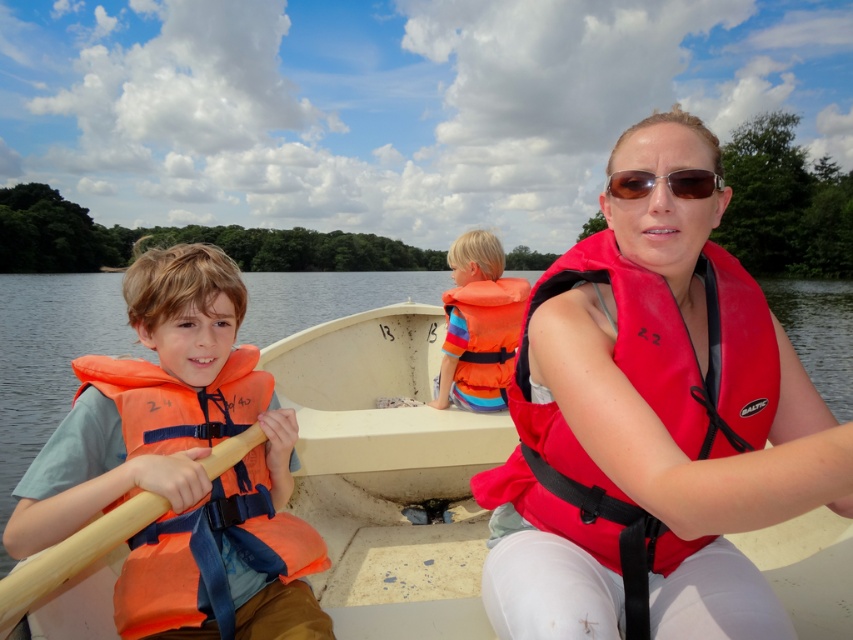
Question: Can you confirm if white plastic boat at center is positioned above orange life vest at left?

Choices:
 (A) no
 (B) yes

Answer: (B)

Question: Does orange life vest at left lie in front of matte brown sunglasses at center?

Choices:
 (A) no
 (B) yes

Answer: (B)

Question: Which object appears farthest from the camera in this image?

Choices:
 (A) orange fabric life jacket at center
 (B) matte brown sunglasses at center
 (C) wooden paddle at center

Answer: (A)

Question: Which object is the closest to the orange life vest at left?

Choices:
 (A) wooden paddle at center
 (B) matte red life vest at center
 (C) matte brown sunglasses at center

Answer: (A)

Question: Which of these objects is positioned closest to the matte brown sunglasses at center?

Choices:
 (A) orange fabric life jacket at center
 (B) wooden paddle at center

Answer: (B)

Question: Does white plastic boat at center have a lesser width compared to matte brown sunglasses at center?

Choices:
 (A) yes
 (B) no

Answer: (B)